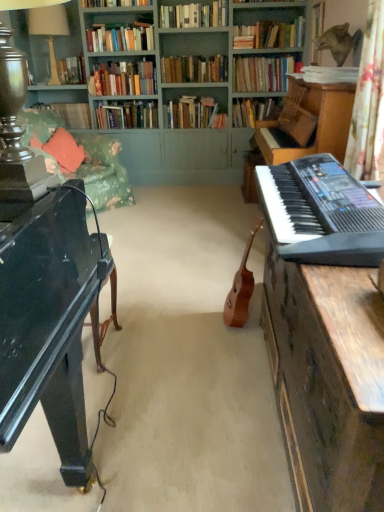
Question: Based on their sizes in the image, would you say hardcover book at upper left, which is counted as the eleventh book, starting from the front, is bigger or smaller than hardcover books at upper center, the 8th book in the back-to-front sequence?

Choices:
 (A) small
 (B) big

Answer: (A)

Question: Is hardcover book at upper left, which is counted as the eleventh book, starting from the front, to the left or to the right of hardcover books at upper center, the 8th book in the back-to-front sequence, in the image?

Choices:
 (A) right
 (B) left

Answer: (B)

Question: Estimate the real-world distances between objects in this image. Which object is farther from the green painted wood bookcase at upper center?

Choices:
 (A) hardcover book at upper center, the second book when ordered from front to back
 (B) light brown wood guitar at center
 (C) hardcover books at center, which is the ninth book from front to back
 (D) floral fabric curtain at right
 (E) white paper at upper right, the first book viewed from the front

Answer: (D)

Question: Based on their relative distances, which object is nearer to the hardcover books at center, the seventh book from the front?

Choices:
 (A) light brown wood guitar at center
 (B) floral fabric couch at upper left
 (C) white glossy table lamp at upper left
 (D) hardcover books at upper center, which is the 6th book from back to front
 (E) black plastic keyboard at right

Answer: (D)